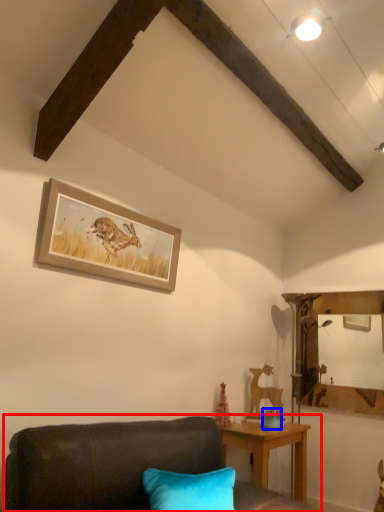
Question: Among these objects, which one is farthest to the camera, studio couch (highlighted by a red box) or teal (highlighted by a blue box)?

Choices:
 (A) studio couch
 (B) teal

Answer: (B)